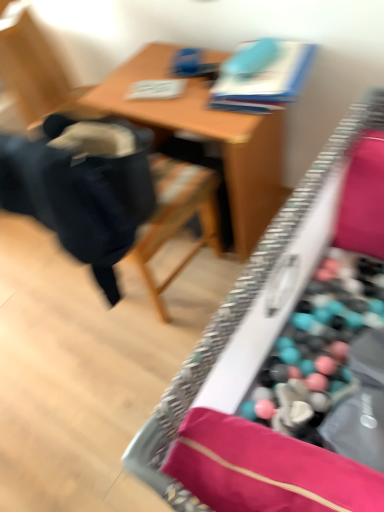
You are a GUI agent. You are given a task and a screenshot of the screen. Output one action in this format:
    pyautogui.click(x=<x>, y=<y>)
    Task: Click on the vacant space situated on the left part of black fabric chair at left
    
    Given the screenshot: What is the action you would take?
    pos(51,315)